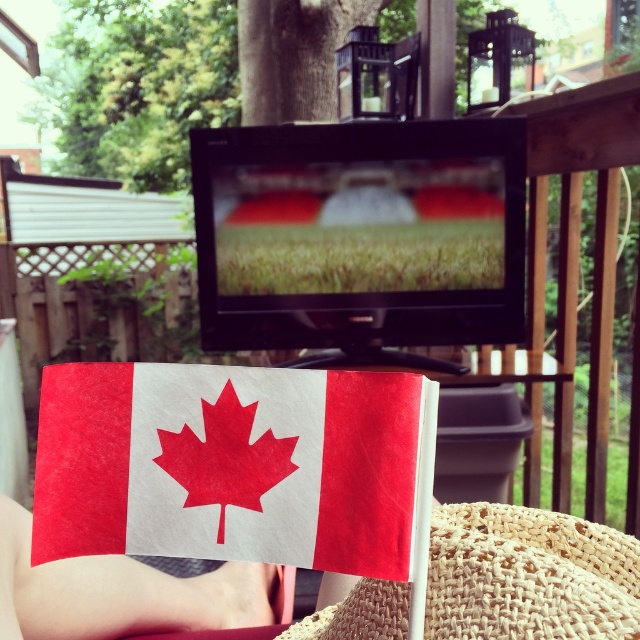
Question: Is woven straw hat at lower center above white paper canadian flag at center?

Choices:
 (A) no
 (B) yes

Answer: (B)

Question: Which object is closer to the camera taking this photo?

Choices:
 (A) woven straw hat at lower center
 (B) matte paper flag at center

Answer: (B)

Question: Considering the real-world distances, which object is farthest from the matte paper flag at center?

Choices:
 (A) woven straw hat at lower center
 (B) white paper canadian flag at center

Answer: (B)

Question: Is matte paper flag at center thinner than woven straw hat at lower center?

Choices:
 (A) no
 (B) yes

Answer: (B)

Question: Among these points, which one is nearest to the camera?

Choices:
 (A) (58, 442)
 (B) (502, 532)

Answer: (A)

Question: Can you confirm if matte paper flag at center is positioned to the left of woven straw hat at lower center?

Choices:
 (A) no
 (B) yes

Answer: (B)